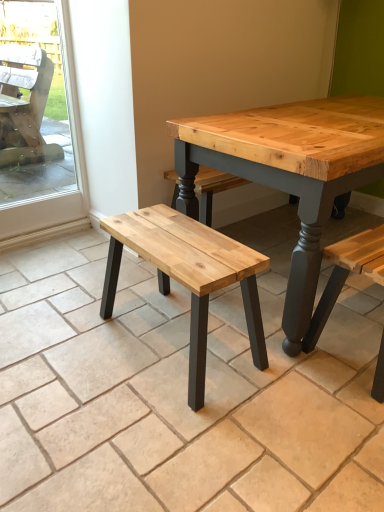
Find the location of a particular element. Image resolution: width=384 pixels, height=512 pixels. vacant area in front of natural wood bench at center is located at coordinates (172, 436).